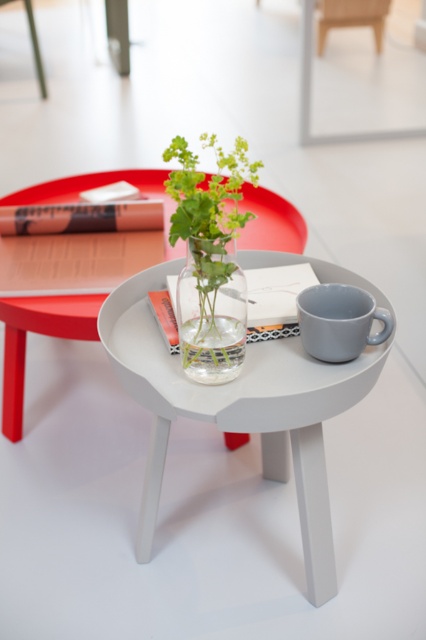
Question: Which is farther from the transparent glass vase at center?

Choices:
 (A) matte white table at center
 (B) white matte side table at center
 (C) green matte plant at center
 (D) translucent glass vase at center

Answer: (B)

Question: Estimate the real-world distances between objects in this image. Which object is closer to the green matte plant at center?

Choices:
 (A) matte gray mug at lower right
 (B) transparent glass vase at center
 (C) translucent glass vase at center
 (D) matte white table at center

Answer: (C)

Question: Is translucent glass vase at center in front of green matte plant at center?

Choices:
 (A) no
 (B) yes

Answer: (A)

Question: Which object is farther from the camera taking this photo?

Choices:
 (A) translucent glass vase at center
 (B) white matte side table at center

Answer: (B)

Question: Does matte white table at center appear under transparent glass vase at center?

Choices:
 (A) yes
 (B) no

Answer: (A)

Question: Can you confirm if white matte side table at center is positioned to the left of matte gray mug at lower right?

Choices:
 (A) yes
 (B) no

Answer: (A)